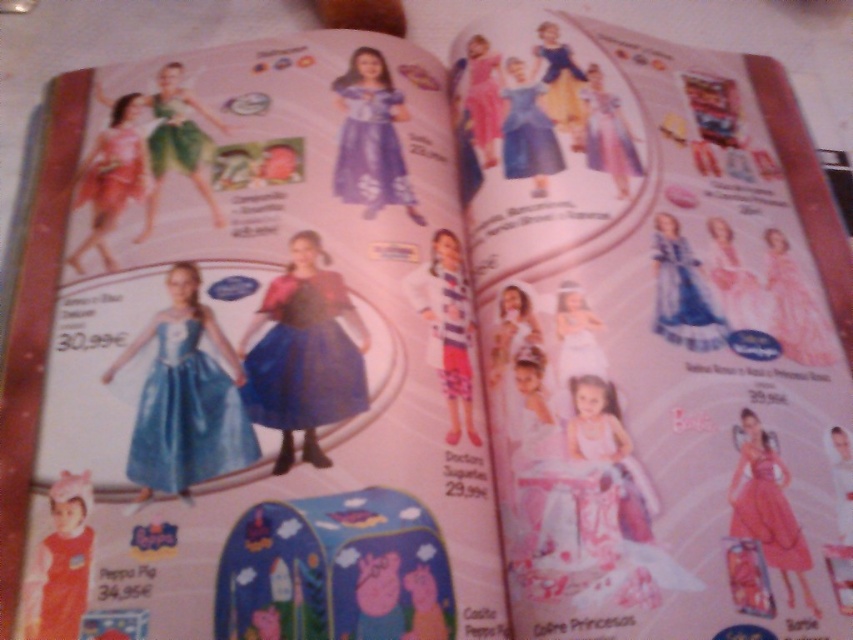
You are a child looking at the magazine page and want to touch the pink satin dress at upper left and the pink satin dress at upper center. Which one do you need to reach out further to touch?

The pink satin dress at upper center requires reaching out further because it is farther from the viewer compared to the pink satin dress at upper left, which is closer.

You are looking at the magazine page and want to touch the two points mentioned. Which point would you need to reach out further to touch, point at (88, 246) or point at (460, 152)?

Point at (460, 152) requires reaching further because it is farther from the viewer compared to point at (88, 246), which is closer.